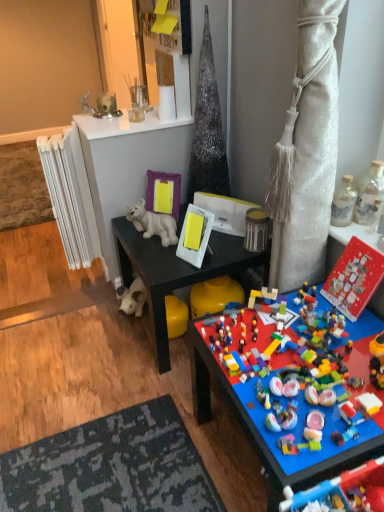
Find the location of `blank space to the left of metallic silver canister at upper right, which is counted as the 5th toy, starting from the top`. blank space to the left of metallic silver canister at upper right, which is counted as the 5th toy, starting from the top is located at coordinates point(231,242).